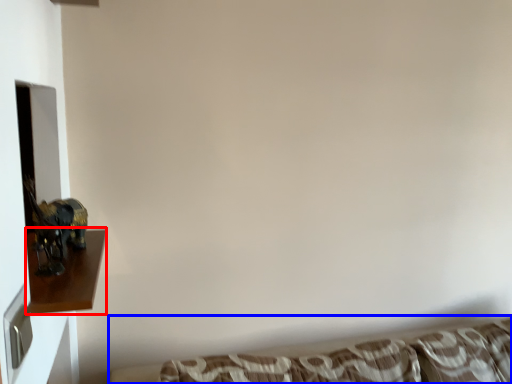
Question: Which point is further to the camera, furniture (highlighted by a red box) or studio couch (highlighted by a blue box)?

Choices:
 (A) furniture
 (B) studio couch

Answer: (B)